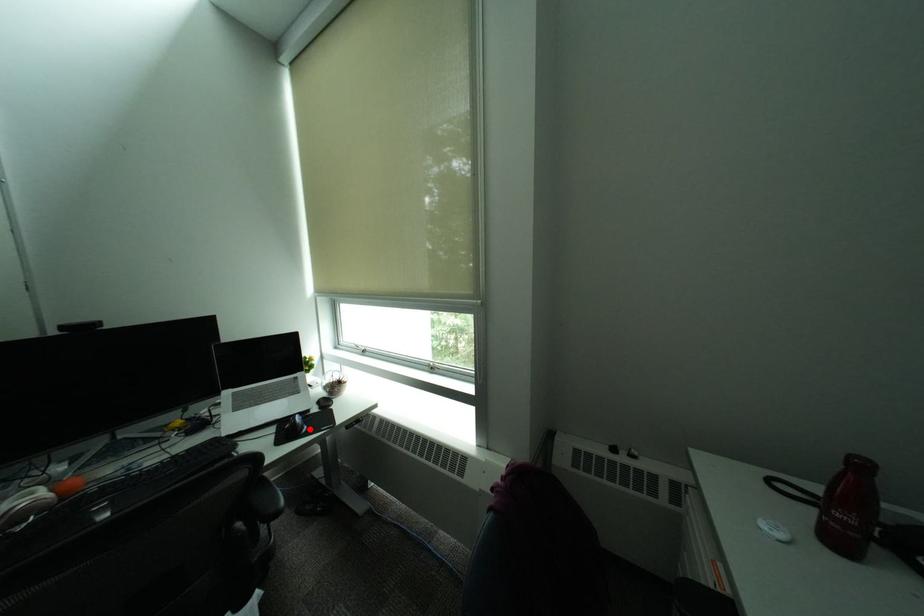
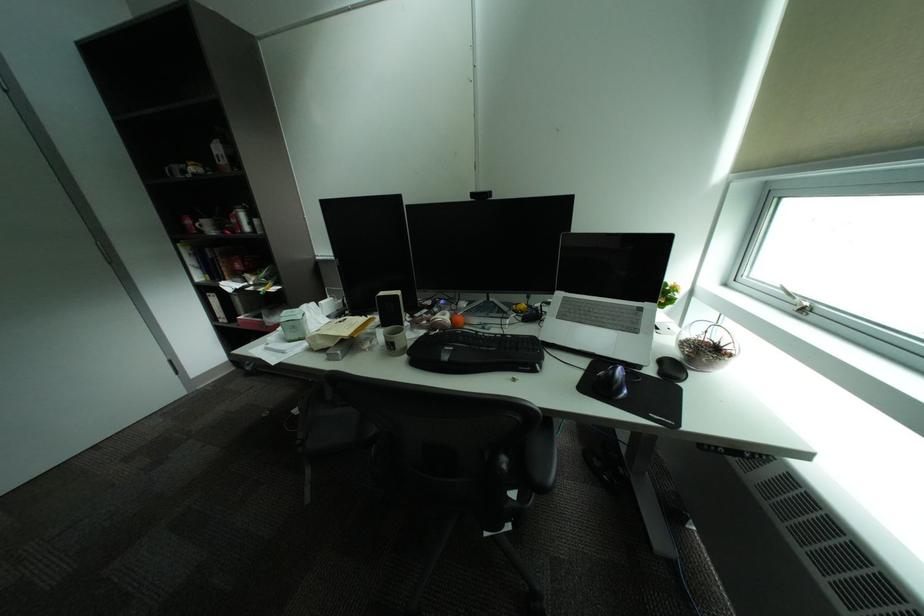
Where in the second image is the point corresponding to the highlighted location from the first image?

(626, 389)